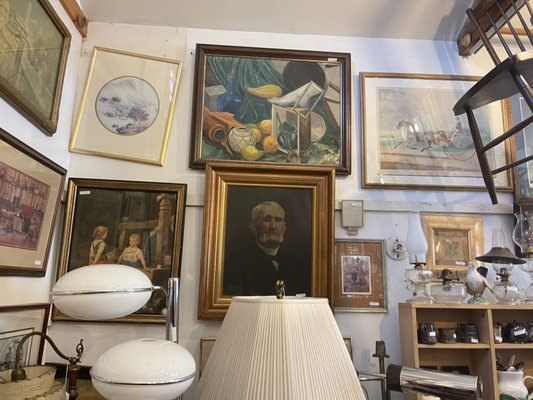
Find the location of a particular element. white pitcher is located at coordinates (514, 380).